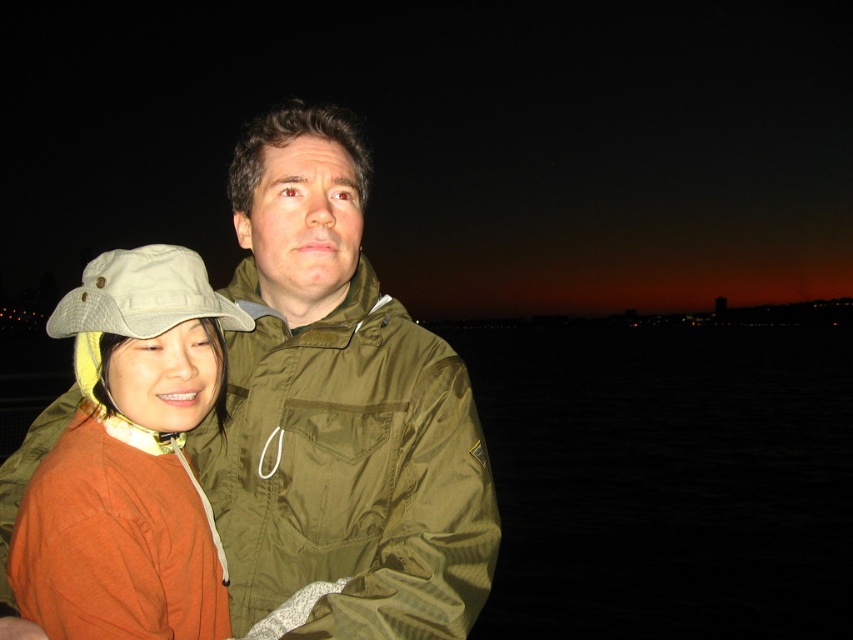
Image resolution: width=853 pixels, height=640 pixels. Identify the location of orange matte jacket at center. (339, 412).

Can you confirm if orange matte jacket at center is positioned to the right of olive green fabric jacket at center?

No, orange matte jacket at center is not to the right of olive green fabric jacket at center.

The image size is (853, 640). In order to click on orange matte jacket at center in this screenshot , I will do `click(339, 412)`.

Does point (285, 148) come closer to viewer compared to point (469, 584)?

No, it is behind (469, 584).

This screenshot has height=640, width=853. What are the coordinates of `orange matte jacket at center` in the screenshot? It's located at (339, 412).

Where is `olive green fabric jacket at center`? This screenshot has width=853, height=640. olive green fabric jacket at center is located at coordinates (349, 470).

Is point (228, 396) more distant than point (68, 502)?

Yes, point (228, 396) is behind point (68, 502).

Is point (242, 268) more distant than point (138, 307)?

Yes, point (242, 268) is behind point (138, 307).

At what (x,y) coordinates should I click in order to perform the action: click on olive green fabric jacket at center. Please return your answer as a coordinate pair (x, y). Image resolution: width=853 pixels, height=640 pixels. Looking at the image, I should click on (349, 470).